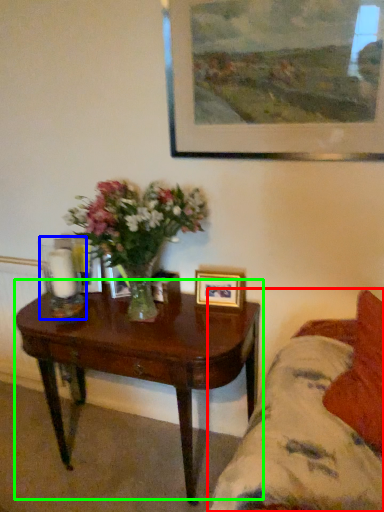
Question: Which object is the farthest from studio couch (highlighted by a red box)? Choose among these: candle holder (highlighted by a blue box) or coffee table (highlighted by a green box).

Choices:
 (A) candle holder
 (B) coffee table

Answer: (A)